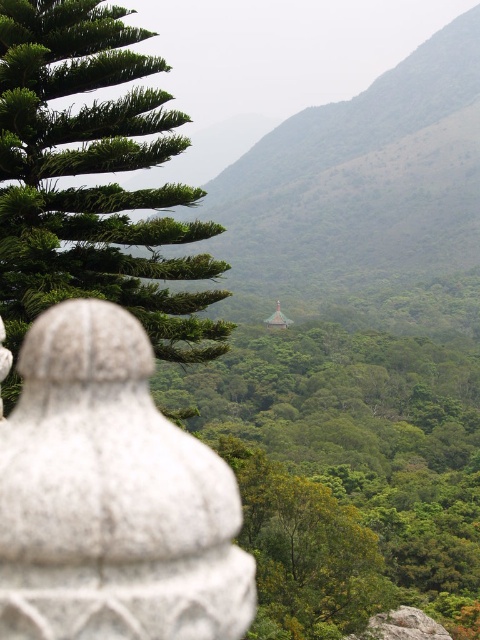
You are standing in the scenic view and want to move from the point closer to you to the point further away. Which path would you take between the two points, point 1 at [367,342] and point 2 at [168,182]?

The path from point 1 at [367,342] to point 2 at [168,182] requires moving towards the background since point 1 is closer to the viewer than point 2.

Based on the coordinates provided, which object corresponds to the point at (347, 472)?

The point at (347, 472) corresponds to the green leafy tree at center.

You are a hiker who wants to take a photo of the white stone structure in the lower left. You have a camera with a zoom lens. Which tree, the green leafy tree at center or the green leafy tree at upper left, is closer to the camera and might block your view of the white stone structure?

The green leafy tree at upper left is closer to the camera because it is positioned higher in the frame, which typically indicates proximity in such compositions. This tree might block your view of the white stone structure in the lower left.